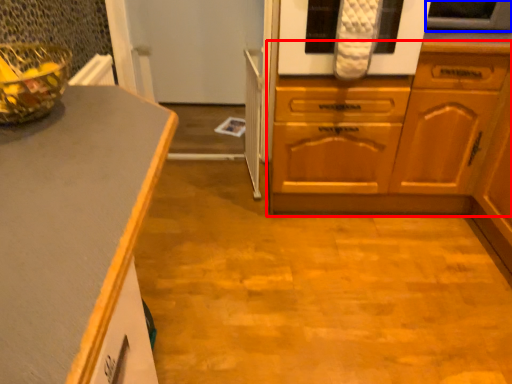
Question: Which object is further to the camera taking this photo, cabinetry (highlighted by a red box) or appliance (highlighted by a blue box)?

Choices:
 (A) cabinetry
 (B) appliance

Answer: (B)